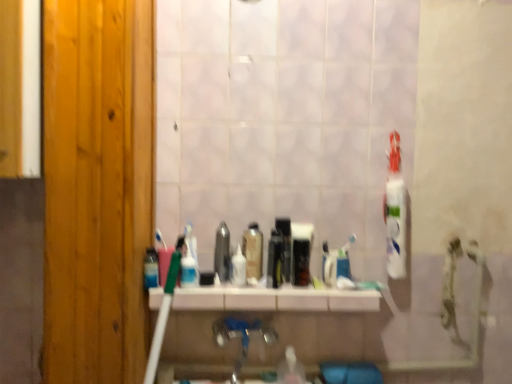
The height and width of the screenshot is (384, 512). I want to click on free space above white glossy shelf at center (from a real-world perspective), so click(285, 288).